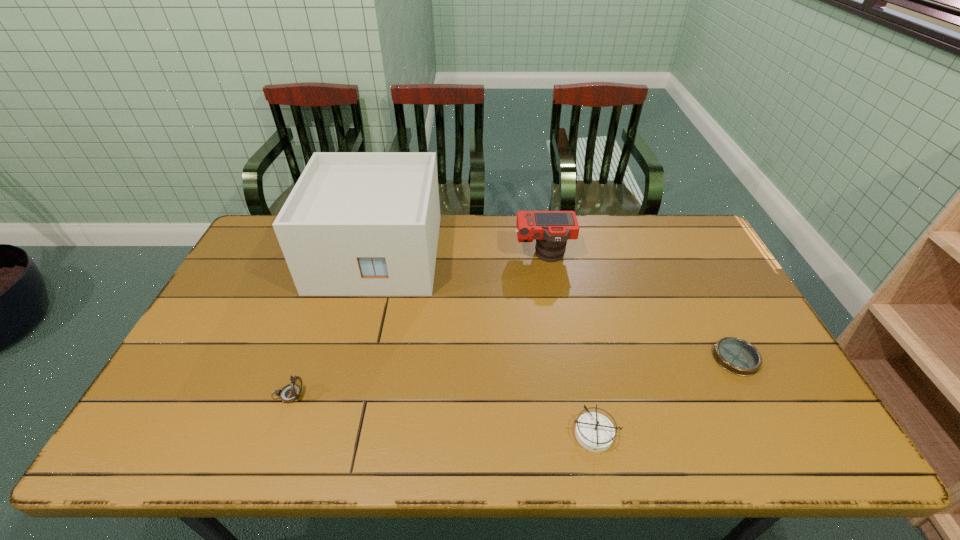
The image size is (960, 540). I want to click on vacant area that satisfies the following two spatial constraints: 1. on the front side of the nearest compass; 2. on the left side of the camera, so click(573, 434).

Image resolution: width=960 pixels, height=540 pixels. What are the coordinates of `blank area in the image that satisfies the following two spatial constraints: 1. on the face of the fourth tallest object; 2. on the left side of the third shortest object` in the screenshot? It's located at (274, 434).

At what (x,y) coordinates should I click in order to perform the action: click on free point that satisfies the following two spatial constraints: 1. on the face of the leftmost compass; 2. on the left side of the second compass from left to right. Please return your answer as a coordinate pair (x, y). Looking at the image, I should click on (274, 434).

Locate an element on the screen. The height and width of the screenshot is (540, 960). vacant position in the image that satisfies the following two spatial constraints: 1. on the side of the tallest object with the window; 2. on the right side of the fourth shortest object is located at coordinates (376, 255).

The image size is (960, 540). I want to click on free space that satisfies the following two spatial constraints: 1. on the side of the tallest object with the window; 2. on the left side of the nearest compass, so click(x=329, y=434).